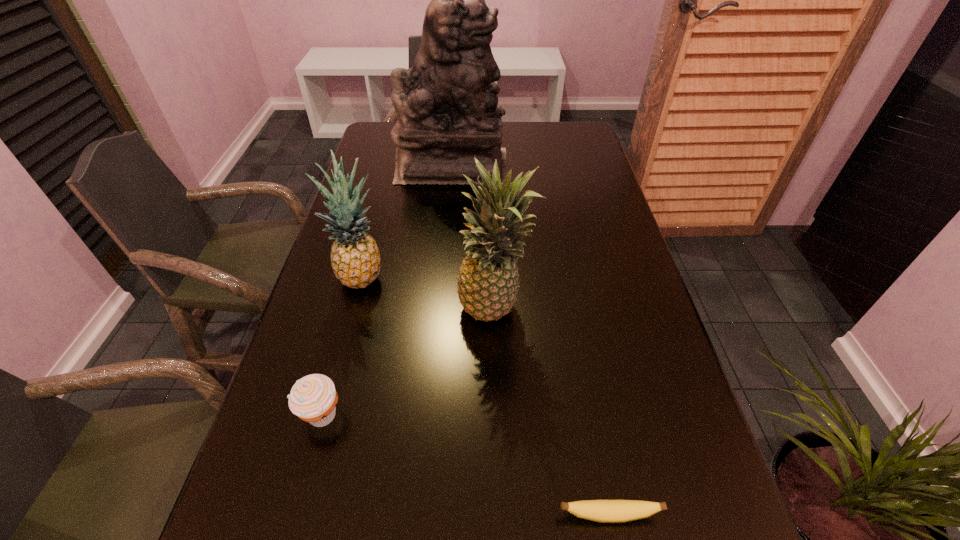
Find the location of a particular element. The height and width of the screenshot is (540, 960). free region located 0.230m on the back of the left pineapple is located at coordinates (382, 207).

Identify the location of free region located on the back of the fourth tallest object. The image size is (960, 540). (350, 309).

The image size is (960, 540). Find the location of `vacant space situated 0.260m on the back of the rightmost object`. vacant space situated 0.260m on the back of the rightmost object is located at coordinates (581, 368).

Locate an element on the screen. Image resolution: width=960 pixels, height=540 pixels. object that is at the far edge is located at coordinates (447, 110).

Find the location of a particular element. sculpture located in the left edge section of the desktop is located at coordinates (447, 110).

The image size is (960, 540). Find the location of `pineapple positioned at the left edge`. pineapple positioned at the left edge is located at coordinates (355, 258).

The image size is (960, 540). Find the location of `muffin that is at the left edge`. muffin that is at the left edge is located at coordinates (313, 398).

Where is `object at the right edge`? This screenshot has height=540, width=960. object at the right edge is located at coordinates tap(604, 511).

You are a GUI agent. You are given a task and a screenshot of the screen. Output one action in this format:
    pyautogui.click(x=<x>, y=<y>)
    Task: Click on the object present at the far left corner
    Image resolution: width=960 pixels, height=540 pixels.
    Given the screenshot: What is the action you would take?
    pyautogui.click(x=447, y=110)

Find the location of a particular element. blank area at the far edge is located at coordinates (534, 149).